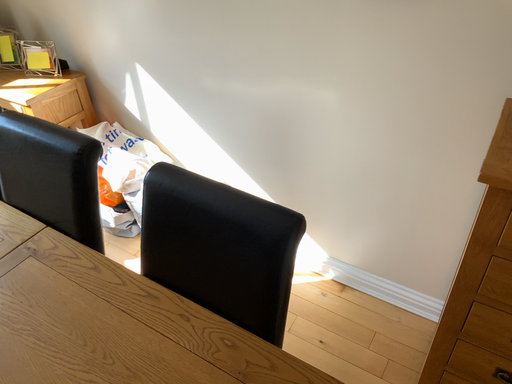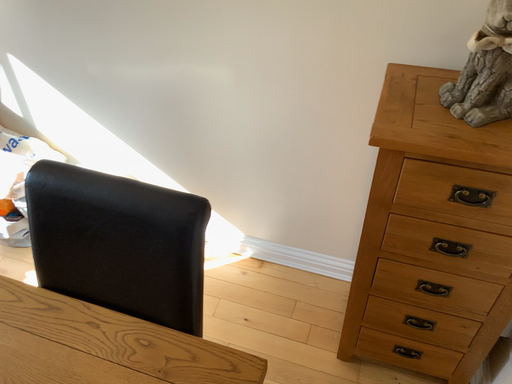
Question: How did the camera likely rotate when shooting the video?

Choices:
 (A) rotated left
 (B) rotated right

Answer: (B)